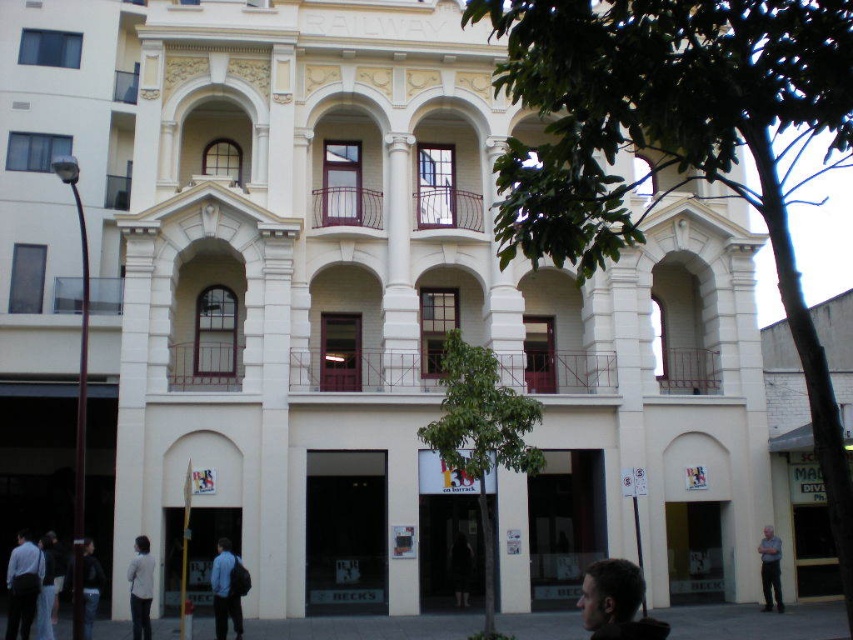
This screenshot has height=640, width=853. In order to click on blue fabric jacket at lower center in this screenshot , I will do `click(228, 589)`.

Which of these two, dark blue jacket at lower left or dark fabric jacket at lower center, stands taller?

With more height is dark blue jacket at lower left.

Between point (96, 598) and point (456, 593), which one is positioned behind?

Positioned behind is point (456, 593).

Where is `dark blue jacket at lower left`? dark blue jacket at lower left is located at coordinates (90, 586).

At what (x,y) coordinates should I click in order to perform the action: click on dark blue jacket at lower left. Please return your answer as a coordinate pair (x, y). Looking at the image, I should click on (90, 586).

Is light blue shirt at lower left smaller than dark fabric jacket at lower center?

Actually, light blue shirt at lower left might be larger than dark fabric jacket at lower center.

Is point (33, 589) behind point (461, 563)?

That is False.

Locate an element on the screen. light blue shirt at lower left is located at coordinates (22, 584).